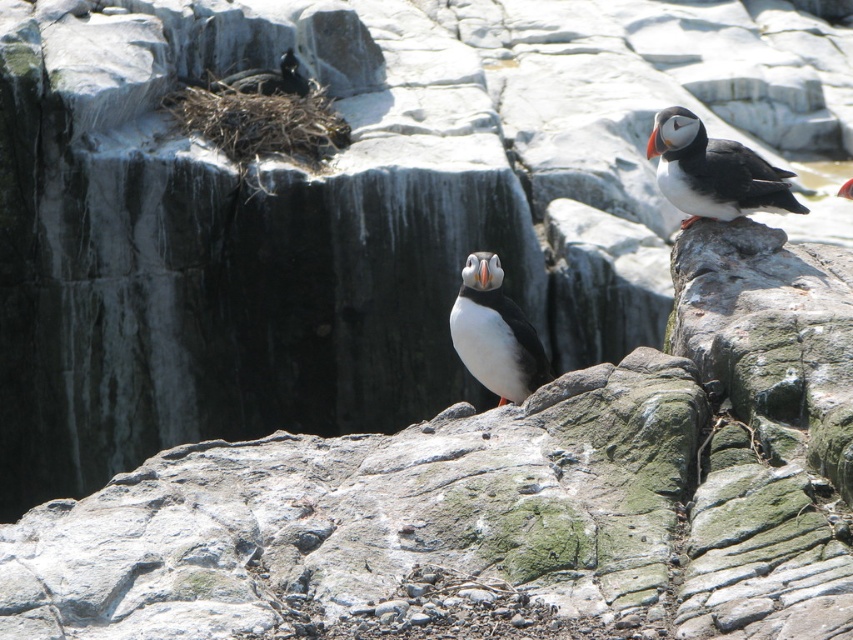
Can you confirm if black matte puffin at right is positioned above white matte puffin at center?

Yes.

Between point (715, 188) and point (544, 380), which one is positioned in front?

Positioned in front is point (544, 380).

Where is `black matte puffin at right`? The image size is (853, 640). black matte puffin at right is located at coordinates (712, 172).